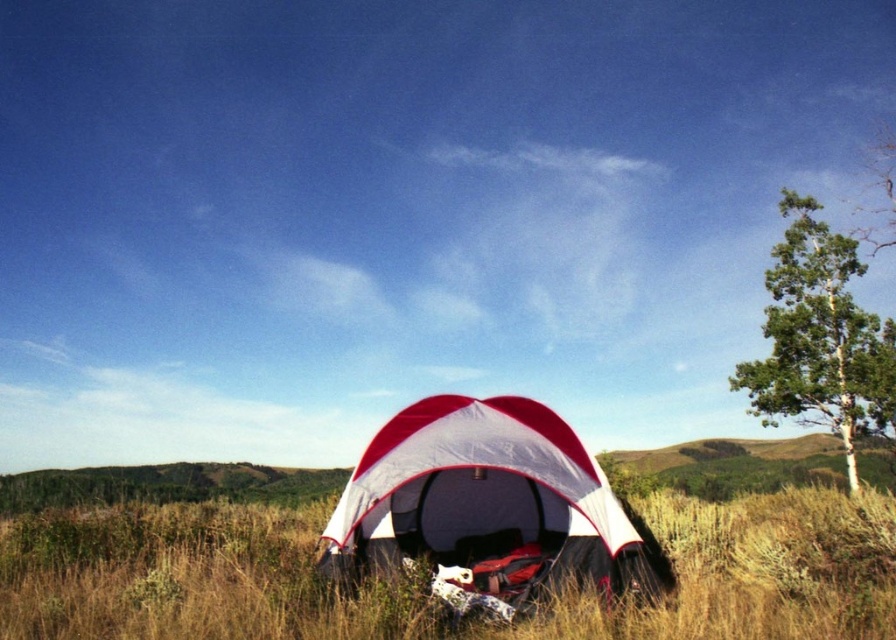
Can you confirm if white/red fabric tent at center is positioned above green smooth bark tree at right?

No.

Image resolution: width=896 pixels, height=640 pixels. What do you see at coordinates (489, 500) in the screenshot? I see `white/red fabric tent at center` at bounding box center [489, 500].

I want to click on white/red fabric tent at center, so click(x=489, y=500).

Is grassy field at center thinner than green smooth bark tree at right?

In fact, grassy field at center might be wider than green smooth bark tree at right.

Describe the element at coordinates (421, 596) in the screenshot. I see `grassy field at center` at that location.

I want to click on grassy field at center, so click(x=421, y=596).

Between grassy field at center and white/red fabric tent at center, which one has more height?

white/red fabric tent at center is taller.

Which is more to the right, grassy field at center or white/red fabric tent at center?

From the viewer's perspective, grassy field at center appears more on the right side.

Which is in front, point (93, 531) or point (601, 564)?

Point (601, 564) is more forward.

Locate an element on the screen. Image resolution: width=896 pixels, height=640 pixels. grassy field at center is located at coordinates (x=421, y=596).